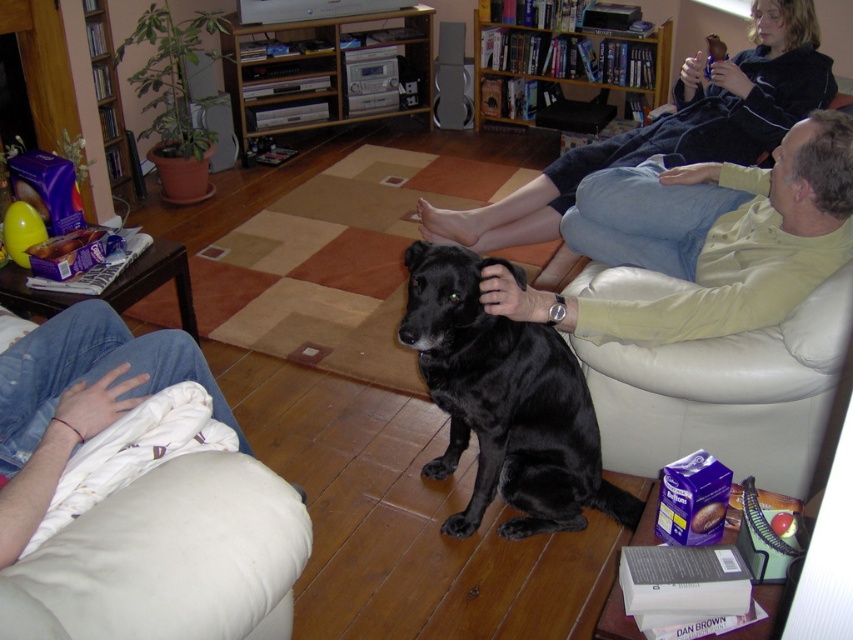
Question: Which object is positioned closest to the black shiny dog at center?

Choices:
 (A) black fur dog at center
 (B) matte yellow shirt at center

Answer: (B)

Question: Does matte yellow shirt at center appear under black fur dog at center?

Choices:
 (A) no
 (B) yes

Answer: (B)

Question: Which is nearer to the matte yellow shirt at center?

Choices:
 (A) black shiny dog at center
 (B) black fur dog at center

Answer: (A)

Question: Does matte yellow shirt at center lie behind black fur dog at center?

Choices:
 (A) no
 (B) yes

Answer: (A)

Question: Which object appears farthest from the camera in this image?

Choices:
 (A) black shiny dog at center
 (B) matte yellow shirt at center

Answer: (A)

Question: Is matte yellow shirt at center positioned at the back of black shiny dog at center?

Choices:
 (A) yes
 (B) no

Answer: (B)